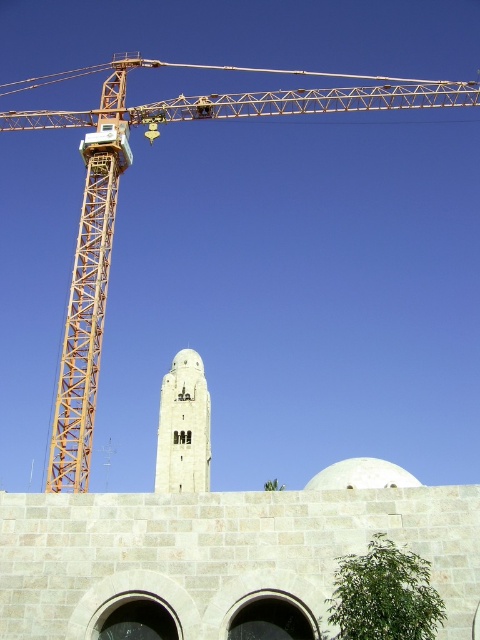
You are standing in front of the construction site and want to determine which of the two points, point (51, 540) or point (184, 358), is nearer to you. Based on the image, which point is closer?

Point (51, 540) is closer to the viewer than point (184, 358).

You are standing at a safe distance from the construction crane and the tower. The point at coordinates point (326,547) is a reference point near the crane. If you want to move closer to the crane, should you walk towards or away from the tower?

The point at coordinates point (326,547) is 33.13 meters away from you. To move closer to the crane, you should walk towards the crane, which would mean moving away from the tower since the point near the crane is your current reference and the tower is in the background.